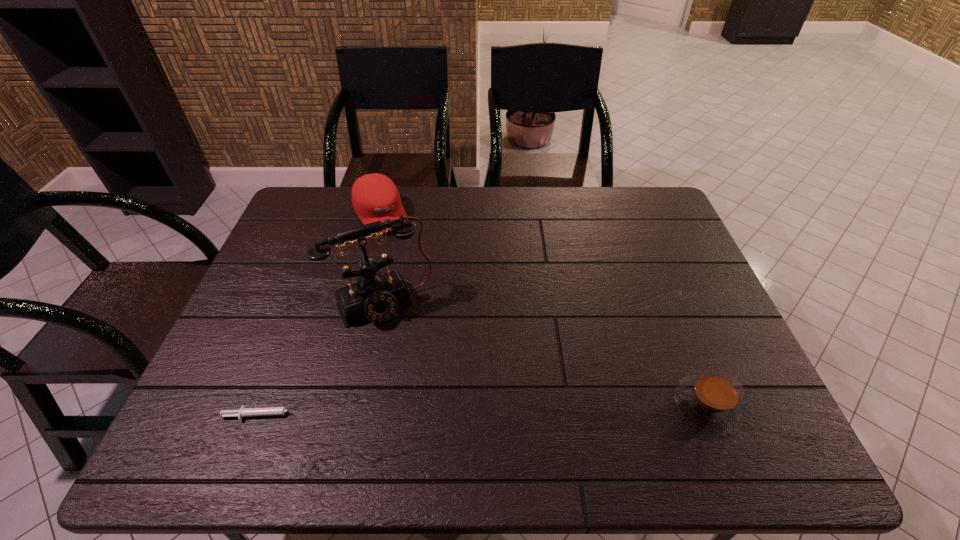
Locate an element on the screen. This screenshot has height=540, width=960. object located in the near left corner section of the desktop is located at coordinates (271, 411).

This screenshot has height=540, width=960. I want to click on object that is at the near right corner, so click(x=712, y=400).

Find the location of `vacant space at the far edge of the desktop`. vacant space at the far edge of the desktop is located at coordinates (551, 215).

I want to click on vacant area at the near edge of the desktop, so click(411, 390).

Identify the location of free space at the left edge of the desktop. (285, 245).

In the image, there is a desktop. Identify the location of vacant space at the right edge. The height and width of the screenshot is (540, 960). (676, 353).

Image resolution: width=960 pixels, height=540 pixels. Find the location of `vacant area at the far right corner of the desktop`. vacant area at the far right corner of the desktop is located at coordinates (646, 217).

Find the location of a particular element. This screenshot has height=540, width=960. vacant space in between the third nearest object and the syringe is located at coordinates (324, 360).

At what (x,y) coordinates should I click in order to perform the action: click on vacant space in between the shortest object and the telephone. Please return your answer as a coordinate pair (x, y). Looking at the image, I should click on (324, 360).

Find the location of a particular element. This screenshot has height=540, width=960. unoccupied position between the farthest object and the cappuccino is located at coordinates (543, 310).